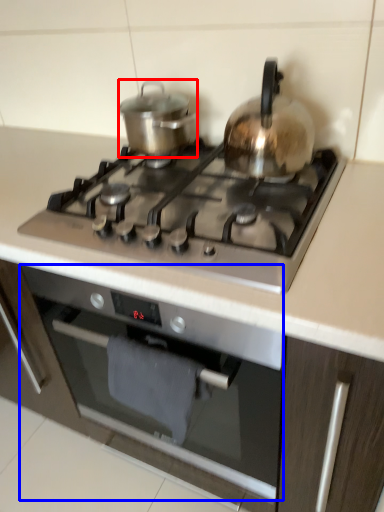
Question: Among these objects, which one is nearest to the camera, kitchen appliance (highlighted by a red box) or oven (highlighted by a blue box)?

Choices:
 (A) kitchen appliance
 (B) oven

Answer: (B)